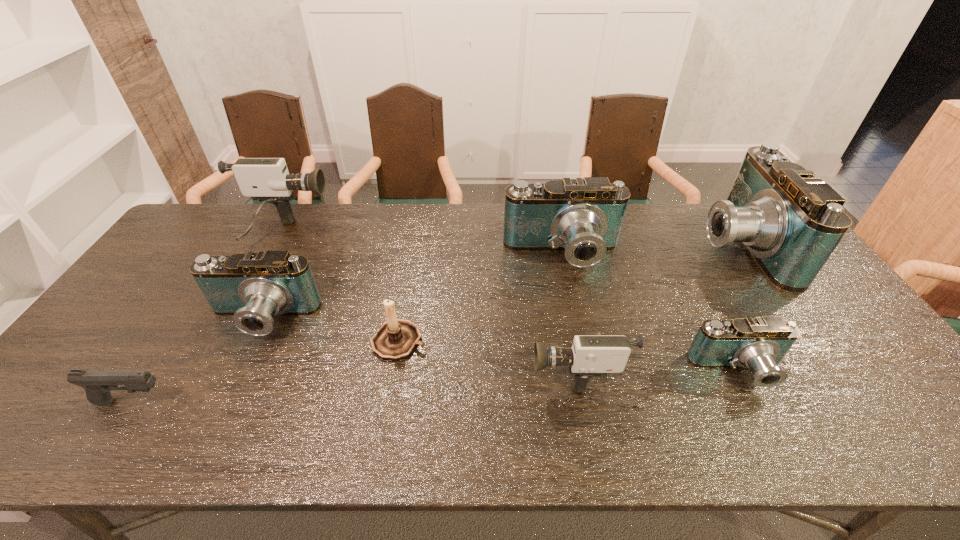
What are the coordinates of `the biggest blue camcorder` in the screenshot? It's located at (791, 222).

I want to click on the bigger white camcorder, so click(x=268, y=180).

Where is `the farther white camcorder`? Image resolution: width=960 pixels, height=540 pixels. the farther white camcorder is located at coordinates (268, 180).

Where is `the third blue camcorder from right to left`? The width and height of the screenshot is (960, 540). the third blue camcorder from right to left is located at coordinates (583, 217).

You are a GUI agent. You are given a task and a screenshot of the screen. Output one action in this format:
    pyautogui.click(x=<x>, y=<y>)
    Task: Click on the leftmost blue camcorder
    
    Given the screenshot: What is the action you would take?
    pyautogui.click(x=253, y=287)

Image resolution: width=960 pixels, height=540 pixels. Find the location of `the second smallest blue camcorder`. the second smallest blue camcorder is located at coordinates (253, 287).

I want to click on the smaller white camcorder, so click(x=590, y=355).

Identify the location of the nearer white camcorder. Image resolution: width=960 pixels, height=540 pixels. (590, 355).

This screenshot has width=960, height=540. In order to click on brown candle holder in this screenshot , I will do `click(396, 339)`.

Image resolution: width=960 pixels, height=540 pixels. What are the coordinates of `candle holder` in the screenshot? It's located at [396, 339].